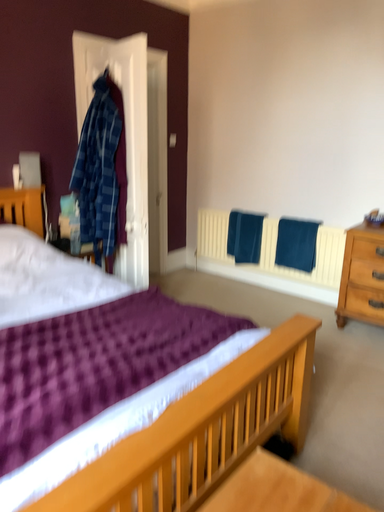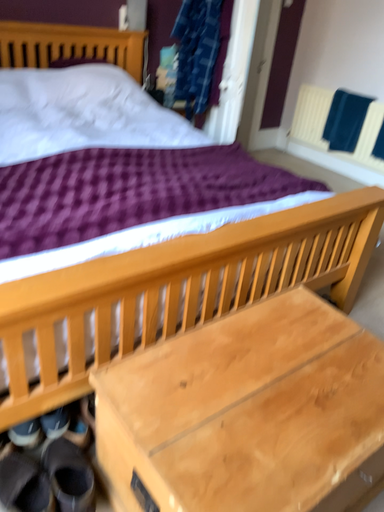
Question: How did the camera likely rotate when shooting the video?

Choices:
 (A) rotated left
 (B) rotated right

Answer: (A)